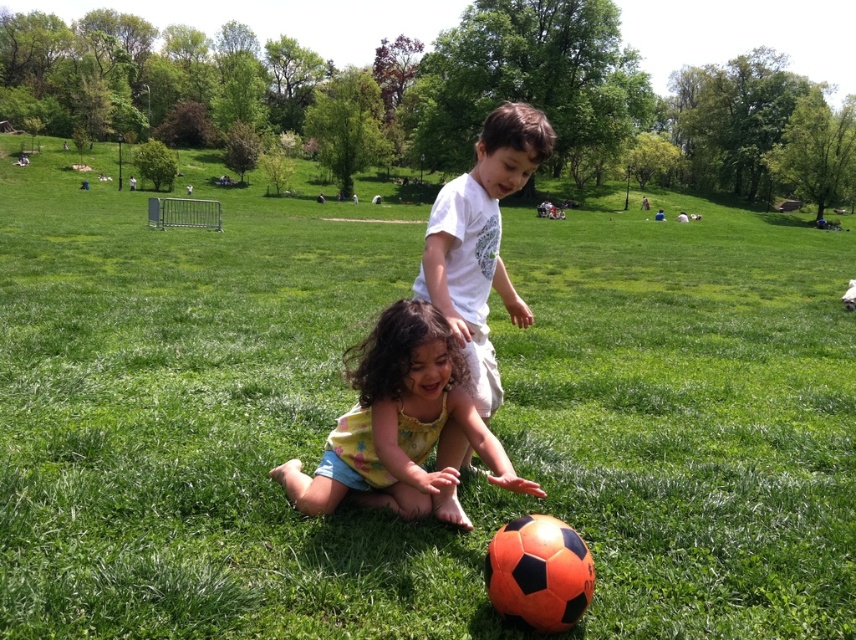
You are a photographer trying to capture a photo of both the yellow floral dress at center and the white cotton shirt at center. Which one would appear closer to the camera in the photo?

The yellow floral dress at center is in front of the white cotton shirt at center, so it will appear closer to the camera in the photo.

You are a photographer standing in the park and want to take a photo of the yellow floral dress at center and the white cotton shirt at center. If your camera has a maximum focus range of 18 inches, will both subjects be in focus?

The yellow floral dress at center and white cotton shirt at center are 17.84 inches apart from each other, which is within the camera maximum focus range of 18 inches. Both subjects will be in focus.